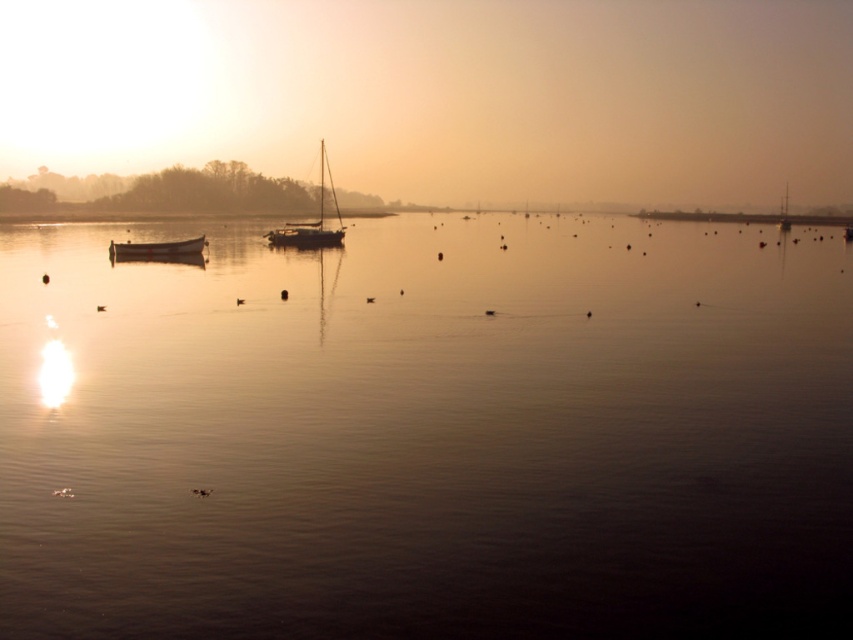
Which of these two, shiny white sailboat at center or matte black boat at left, stands taller?

With more height is shiny white sailboat at center.

Measure the distance between shiny white sailboat at center and camera.

The distance of shiny white sailboat at center from camera is 59.17 meters.

Does point (279, 236) lie behind point (166, 244)?

Yes, it is.

In order to click on shiny white sailboat at center in this screenshot , I will do 310,225.

Which is in front, point (804, 499) or point (173, 253)?

Point (804, 499)

Is smooth water at center wider than matte black boat at left?

Yes, smooth water at center is wider than matte black boat at left.

Between point (248, 301) and point (138, 243), which one is positioned in front?

Point (248, 301) is more forward.

At what (x,y) coordinates should I click in order to perform the action: click on smooth water at center. Please return your answer as a coordinate pair (x, y). The image size is (853, 640). Looking at the image, I should click on (428, 435).

Does smooth water at center have a lesser width compared to shiny white sailboat at center?

Incorrect, smooth water at center's width is not less than shiny white sailboat at center's.

Measure the distance from smooth water at center to shiny white sailboat at center.

A distance of 28.47 meters exists between smooth water at center and shiny white sailboat at center.

Locate an element on the screen. smooth water at center is located at coordinates (428, 435).